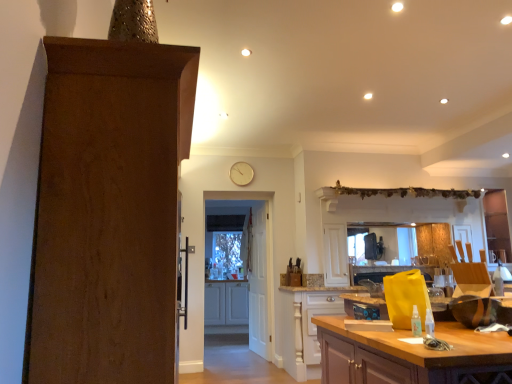
Locate an element on the screen. white wooden door at center, the third door positioned from the front is located at coordinates (259, 285).

Measure the distance between white matte cabinet at center, the third cabinetry in the front-to-back sequence, and camera.

A distance of 6.08 meters exists between white matte cabinet at center, the third cabinetry in the front-to-back sequence, and camera.

Locate an element on the screen. This screenshot has width=512, height=384. light brown wood cabinet at center, positioned as the second cabinetry in back-to-front order is located at coordinates tap(307, 324).

Measure the distance between light brown wood cabinet at center, the 2th cabinetry when ordered from right to left, and camera.

light brown wood cabinet at center, the 2th cabinetry when ordered from right to left, and camera are 13.76 feet apart from each other.

Image resolution: width=512 pixels, height=384 pixels. Identify the location of wooden countertop at lower right, which is the first cabinetry in front-to-back order. (410, 356).

Locate an element on the screen. This screenshot has width=512, height=384. brown wood door at left, the third door when ordered from back to front is located at coordinates (108, 211).

Where is `white wooden door at center, the 1th door in the back-to-front sequence`? white wooden door at center, the 1th door in the back-to-front sequence is located at coordinates pos(259,285).

In the scene shown: Is white matte cabinet at center, the 1th cabinetry in the left-to-right sequence, taller than light brown wood cabinet at center, the 2th cabinetry when ordered from right to left?

Incorrect, the height of white matte cabinet at center, the 1th cabinetry in the left-to-right sequence, is not larger of that of light brown wood cabinet at center, the 2th cabinetry when ordered from right to left.

Is white matte cabinet at center, the 1th cabinetry in the left-to-right sequence, not within light brown wood cabinet at center, the 2th cabinetry when ordered from right to left?

Yes.

Are white matte cabinet at center, which is the third cabinetry in right-to-left order, and light brown wood cabinet at center, the 2th cabinetry when ordered from right to left, beside each other?

No.

Does point (212, 308) come behind point (288, 292)?

Yes, it is behind point (288, 292).

Does gold metallic clock at upper center turn towards white matte cabinet at center, which is counted as the first cabinetry, starting from the back?

No, gold metallic clock at upper center is not facing towards white matte cabinet at center, which is counted as the first cabinetry, starting from the back.

Find the location of a particular element. cabinetry located on the left of gold metallic clock at upper center is located at coordinates (226, 303).

From a real-world perspective, who is located higher, gold metallic clock at upper center or white matte cabinet at center, which is the third cabinetry in right-to-left order?

From a 3D spatial view, gold metallic clock at upper center is above.

How much distance is there between gold metallic clock at upper center and white matte cabinet at center, the third cabinetry in the front-to-back sequence?

1.86 meters.

From the image's perspective, is white wooden door at center, the third door positioned from the front, located beneath gold metallic clock at upper center?

Yes.

Is white wooden door at center, the third door positioned from the front, facing towards gold metallic clock at upper center?

No, white wooden door at center, the third door positioned from the front, does not turn towards gold metallic clock at upper center.

Which is farther from the camera, (257, 340) or (239, 182)?

The point (257, 340) is farther from the camera.

Does light brown wood cabinet at center, placed as the 2th cabinetry when sorted from left to right, appear on the left side of wooden countertop at lower right, which is the first cabinetry in front-to-back order?

Correct, you'll find light brown wood cabinet at center, placed as the 2th cabinetry when sorted from left to right, to the left of wooden countertop at lower right, which is the first cabinetry in front-to-back order.

Is light brown wood cabinet at center, the 2th cabinetry when ordered from right to left, facing towards wooden countertop at lower right, the first cabinetry when ordered from right to left?

Yes, light brown wood cabinet at center, the 2th cabinetry when ordered from right to left, faces towards wooden countertop at lower right, the first cabinetry when ordered from right to left.

Who is bigger, light brown wood cabinet at center, the 2th cabinetry when ordered from right to left, or wooden countertop at lower right, which is the first cabinetry in front-to-back order?

wooden countertop at lower right, which is the first cabinetry in front-to-back order, is bigger.

Is light brown wood cabinet at center, positioned as the second cabinetry in back-to-front order, wider than wooden countertop at lower right, the third cabinetry from the back?

No.

Consider the image. From the image's perspective, which is below, light brown wood cabinet at center, the 2th cabinetry when ordered from right to left, or white matte cabinet at center, which is the third cabinetry in right-to-left order?

white matte cabinet at center, which is the third cabinetry in right-to-left order, from the image's perspective.

What's the angular difference between light brown wood cabinet at center, which is the 2th cabinetry from front to back, and white matte cabinet at center, the 1th cabinetry in the left-to-right sequence,'s facing directions?

The facing directions of light brown wood cabinet at center, which is the 2th cabinetry from front to back, and white matte cabinet at center, the 1th cabinetry in the left-to-right sequence, are 9.22 degrees apart.

Is light brown wood cabinet at center, which is the 2th cabinetry from front to back, directly adjacent to white matte cabinet at center, the third cabinetry in the front-to-back sequence?

No, light brown wood cabinet at center, which is the 2th cabinetry from front to back, is not with white matte cabinet at center, the third cabinetry in the front-to-back sequence.

Considering their positions, is white matte cabinet at center, which is the third cabinetry in right-to-left order, located in front of or behind brown wood door at left, the 1th door viewed from the front?

In the image, white matte cabinet at center, which is the third cabinetry in right-to-left order, appears behind brown wood door at left, the 1th door viewed from the front.

Is white matte cabinet at center, which is the third cabinetry in right-to-left order, oriented towards brown wood door at left, the 1th door viewed from the front?

Yes, white matte cabinet at center, which is the third cabinetry in right-to-left order, faces towards brown wood door at left, the 1th door viewed from the front.

From a real-world perspective, does white matte cabinet at center, which is the third cabinetry in right-to-left order, stand above brown wood door at left, the third door when ordered from back to front?

No.

Considering the relative positions of white matte cabinet at center, the third cabinetry in the front-to-back sequence, and brown wood door at left, the 1th door viewed from the front, in the image provided, is white matte cabinet at center, the third cabinetry in the front-to-back sequence, to the right of brown wood door at left, the 1th door viewed from the front, from the viewer's perspective?

In fact, white matte cabinet at center, the third cabinetry in the front-to-back sequence, is to the left of brown wood door at left, the 1th door viewed from the front.

Can you confirm if brown wood door at left, the 1th door viewed from the front, is thinner than light brown wood cabinet at center, the 2th cabinetry when ordered from right to left?

Indeed, brown wood door at left, the 1th door viewed from the front, has a lesser width compared to light brown wood cabinet at center, the 2th cabinetry when ordered from right to left.

Is the position of brown wood door at left, the third door when ordered from back to front, more distant than that of light brown wood cabinet at center, which is the 2th cabinetry from front to back?

No, brown wood door at left, the third door when ordered from back to front, is closer to the camera.

Is brown wood door at left, the 1th door viewed from the front, not within light brown wood cabinet at center, which is the 2th cabinetry from front to back?

Indeed, brown wood door at left, the 1th door viewed from the front, is completely outside light brown wood cabinet at center, which is the 2th cabinetry from front to back.

Could you tell me if brown wood door at left, the 1th door viewed from the front, is facing light brown wood cabinet at center, positioned as the second cabinetry in back-to-front order?

No, brown wood door at left, the 1th door viewed from the front, is not facing towards light brown wood cabinet at center, positioned as the second cabinetry in back-to-front order.

Identify the location of cabinetry that is the 1st one when counting forward from the white matte cabinet at center, the third cabinetry in the front-to-back sequence. Image resolution: width=512 pixels, height=384 pixels. (307, 324).

Where is `clock located above the white matte cabinet at center, the third cabinetry in the front-to-back sequence (from a real-world perspective)`? clock located above the white matte cabinet at center, the third cabinetry in the front-to-back sequence (from a real-world perspective) is located at coordinates (241, 173).

When comparing their distances from wooden countertop at lower right, the first cabinetry when ordered from right to left, does brown wood door at left, the third door when ordered from back to front, or light brown wood cabinet at center, positioned as the second cabinetry in back-to-front order, seem closer?

Based on the image, brown wood door at left, the third door when ordered from back to front, appears to be nearer to wooden countertop at lower right, the first cabinetry when ordered from right to left.

Based on their spatial positions, is wooden countertop at lower right, the first cabinetry when ordered from right to left, or light brown wood cabinet at center, positioned as the second cabinetry in back-to-front order, closer to white matte cabinet at center, which is counted as the first cabinetry, starting from the back?

light brown wood cabinet at center, positioned as the second cabinetry in back-to-front order, is positioned closer to the anchor white matte cabinet at center, which is counted as the first cabinetry, starting from the back.

From the image, which object appears to be nearer to white matte cabinet at center, which is counted as the first cabinetry, starting from the back, wooden countertop at lower right, the third cabinetry viewed from the left, or white wooden door at center, the 1th door in the back-to-front sequence?

Among the two, white wooden door at center, the 1th door in the back-to-front sequence, is located nearer to white matte cabinet at center, which is counted as the first cabinetry, starting from the back.

Considering their positions, is white wooden door at center, the second door viewed from the front, positioned closer to gold metallic clock at upper center than light brown wood cabinet at center, positioned as the second cabinetry in back-to-front order?

white wooden door at center, the second door viewed from the front, is closer to gold metallic clock at upper center.

Considering their positions, is white matte cabinet at center, which is counted as the first cabinetry, starting from the back, positioned closer to wooden countertop at lower right, the third cabinetry from the back, than gold metallic clock at upper center?

gold metallic clock at upper center lies closer to wooden countertop at lower right, the third cabinetry from the back, than the other object.

From the image, which object appears to be farther from light brown wood cabinet at center, which is the 2th cabinetry from front to back, white matte cabinet at center, the 1th cabinetry in the left-to-right sequence, or white wooden door at center, the second door from the back?

The object further to light brown wood cabinet at center, which is the 2th cabinetry from front to back, is white matte cabinet at center, the 1th cabinetry in the left-to-right sequence.

From the picture: Looking at the image, which one is located closer to light brown wood cabinet at center, which is the 2th cabinetry from front to back, brown wood door at left, the 1th door viewed from the front, or white wooden door at center, the third door positioned from the front?

white wooden door at center, the third door positioned from the front.

Considering their positions, is brown wood door at left, the third door when ordered from back to front, positioned further to light brown wood cabinet at center, which is the 2th cabinetry from front to back, than white matte cabinet at center, the 1th cabinetry in the left-to-right sequence?

brown wood door at left, the third door when ordered from back to front, lies further to light brown wood cabinet at center, which is the 2th cabinetry from front to back, than the other object.

The image size is (512, 384). Identify the location of cabinetry between wooden countertop at lower right, the third cabinetry viewed from the left, and white wooden door at center, the 1th door in the back-to-front sequence, in the front-back direction. (307, 324).

This screenshot has width=512, height=384. Find the location of `door between wooden countertop at lower right, the third cabinetry viewed from the left, and white wooden door at center, the 1th door in the back-to-front sequence, along the z-axis`. door between wooden countertop at lower right, the third cabinetry viewed from the left, and white wooden door at center, the 1th door in the back-to-front sequence, along the z-axis is located at coordinates (257, 271).

Image resolution: width=512 pixels, height=384 pixels. Find the location of `door located between light brown wood cabinet at center, positioned as the second cabinetry in back-to-front order, and white wooden door at center, the third door positioned from the front, in the depth direction`. door located between light brown wood cabinet at center, positioned as the second cabinetry in back-to-front order, and white wooden door at center, the third door positioned from the front, in the depth direction is located at coordinates (257, 271).

Find the location of a particular element. Image resolution: width=512 pixels, height=384 pixels. cabinetry between brown wood door at left, the third door when ordered from back to front, and light brown wood cabinet at center, positioned as the second cabinetry in back-to-front order, in the front-back direction is located at coordinates (410, 356).